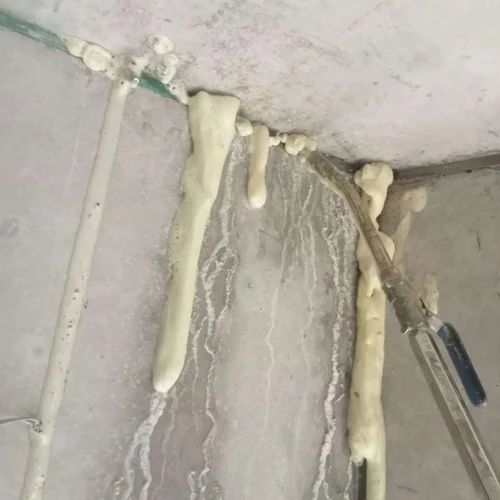
At what (x,y) coordinates should I click in order to perform the action: click on foam. Please return your answer as a coordinate pair (x, y). This screenshot has height=500, width=500. Looking at the image, I should click on (216, 122), (370, 358).